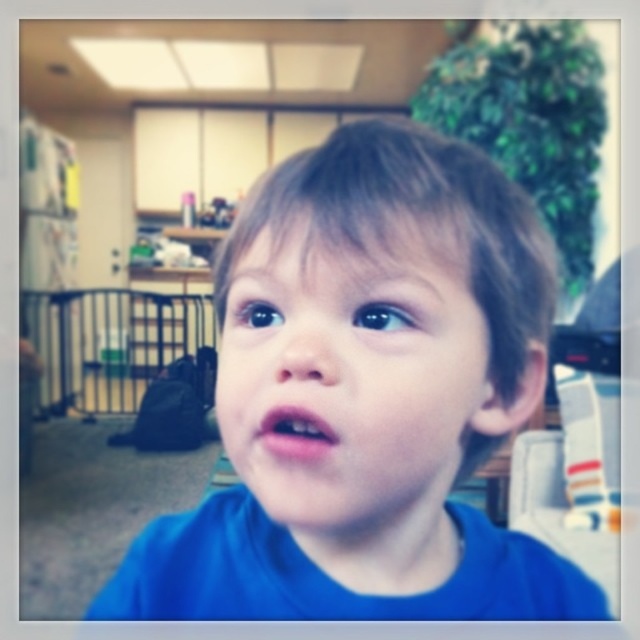
What are the coordinates of the blue matte face at center?

The blue matte face at center is located at coordinates (348, 378).

You are a photographer adjusting the camera focus. You need to ensure that both the blue matte shirt at center and the blue matte face at center are in focus. Which object should you adjust the focus on first to account for their sizes?

The blue matte shirt at center might be wider than blue matte face at center, so you should focus on the larger object first to ensure the entire area is in focus.